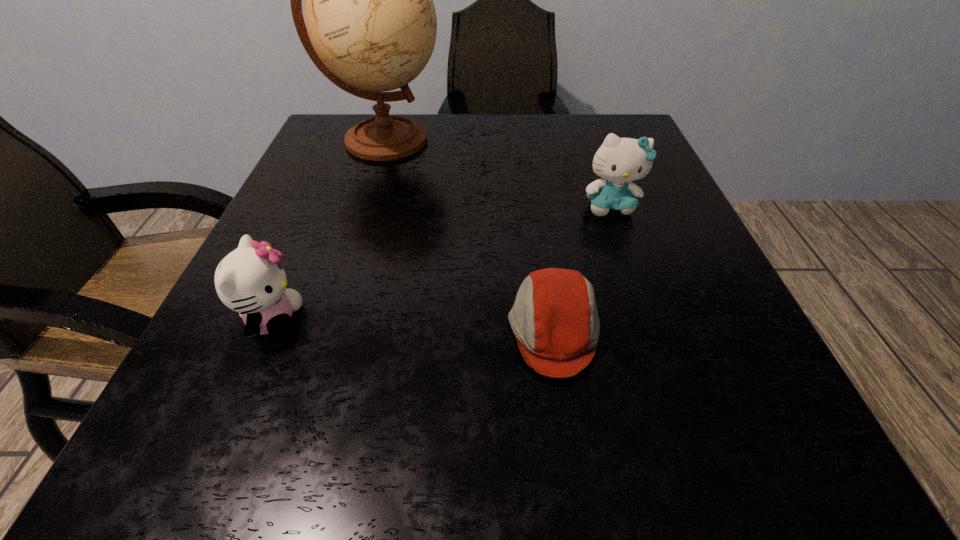
This screenshot has height=540, width=960. In order to click on vacant space located on the front-facing side of the third object from left to right in this screenshot , I will do `click(400, 330)`.

Where is `vacant space located 0.270m on the front-facing side of the third object from left to right`? The image size is (960, 540). vacant space located 0.270m on the front-facing side of the third object from left to right is located at coordinates (314, 330).

Identify the location of free spot located on the front-facing side of the third object from left to right. (242, 330).

The height and width of the screenshot is (540, 960). I want to click on object that is at the far edge, so click(371, 25).

Locate an element on the screen. Image resolution: width=960 pixels, height=540 pixels. globe at the left edge is located at coordinates (371, 25).

The image size is (960, 540). In order to click on kitten positioned at the left edge in this screenshot , I will do `click(250, 280)`.

Locate an element on the screen. This screenshot has height=540, width=960. object that is at the right edge is located at coordinates (619, 161).

Where is `object that is at the far left corner`? object that is at the far left corner is located at coordinates click(371, 25).

In the image, there is a desktop. At what (x,y) coordinates should I click in order to perform the action: click on vacant space at the far edge. Please return your answer as a coordinate pair (x, y). Looking at the image, I should click on (570, 135).

In the image, there is a desktop. Where is `vacant space at the near edge`? The image size is (960, 540). vacant space at the near edge is located at coordinates (536, 438).